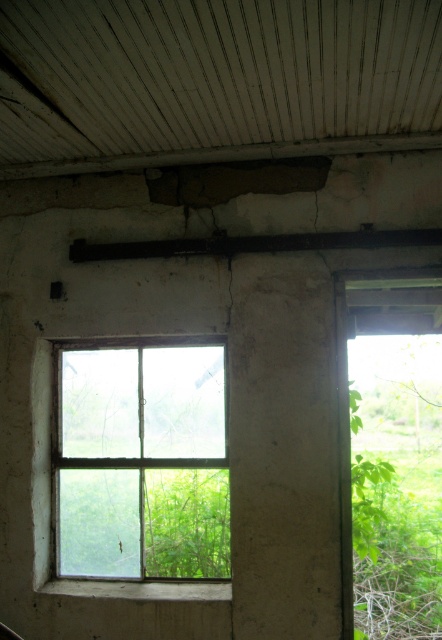
You are a contractor assessing the building for repairs. You notice the clear glass window at center and the black metal beam at upper center. Which object is located to the left of the other?

The clear glass window at center is positioned on the left side of black metal beam at upper center, so the window is to the left of the beam.

You are a contractor assessing the structural integrity of the building. You notice the clear glass window at center and the black metal beam at upper center. Which object has a smaller width measurement?

The clear glass window at center is thinner than the black metal beam at upper center, so the clear glass window at center has a smaller width measurement.